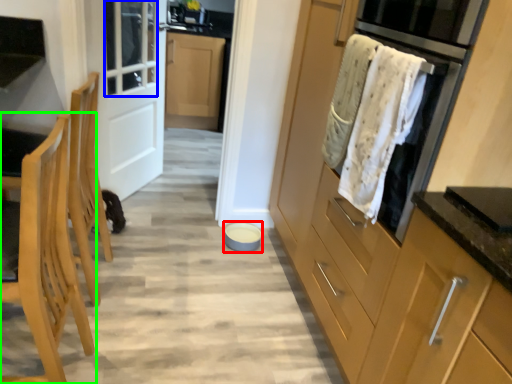
Question: Which object is the closest to the appliance (highlighted by a red box)? Choose among these: window (highlighted by a blue box) or chair (highlighted by a green box).

Choices:
 (A) window
 (B) chair

Answer: (A)